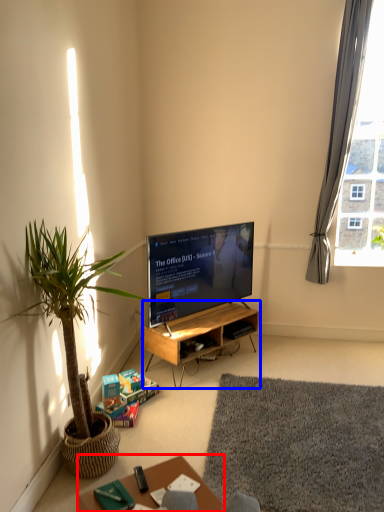
Question: Which object is further to the camera taking this photo, table (highlighted by a red box) or desk (highlighted by a blue box)?

Choices:
 (A) table
 (B) desk

Answer: (B)